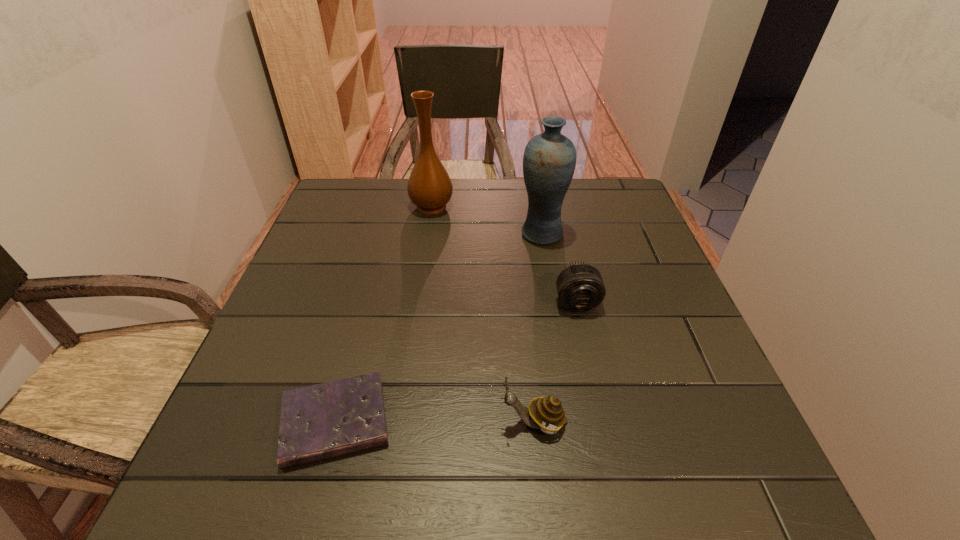
This screenshot has width=960, height=540. I want to click on free spot between the left vase and the fourth tallest object, so click(504, 254).

You are a GUI agent. You are given a task and a screenshot of the screen. Output one action in this format:
    pyautogui.click(x=<x>, y=<y>)
    Task: Click on the free space between the shortest object and the fourth tallest object
    The height and width of the screenshot is (540, 960).
    Given the screenshot: What is the action you would take?
    pyautogui.click(x=456, y=362)

Image resolution: width=960 pixels, height=540 pixels. In order to click on vacant area that lies between the nearer vase and the shortest object in this screenshot , I will do `click(439, 328)`.

Locate an element on the screen. free point between the diary and the left vase is located at coordinates (384, 314).

The image size is (960, 540). Find the location of `the fourth closest object relative to the telephoto lens`. the fourth closest object relative to the telephoto lens is located at coordinates (430, 188).

Choose which object is the third nearest neighbor to the telephoto lens. Please provide its 2D coordinates. Your answer should be formatted as a tuple, i.e. [(x, y)], where the tuple contains the x and y coordinates of a point satisfying the conditions above.

[(321, 421)]

Find the location of a particular element. Image resolution: width=960 pixels, height=540 pixels. free space in the image that satisfies the following two spatial constraints: 1. on the back side of the farther vase; 2. on the left side of the diary is located at coordinates (393, 207).

Where is `vacant space that satisfies the following two spatial constraints: 1. on the back side of the diary; 2. on the left side of the left vase`? vacant space that satisfies the following two spatial constraints: 1. on the back side of the diary; 2. on the left side of the left vase is located at coordinates (393, 207).